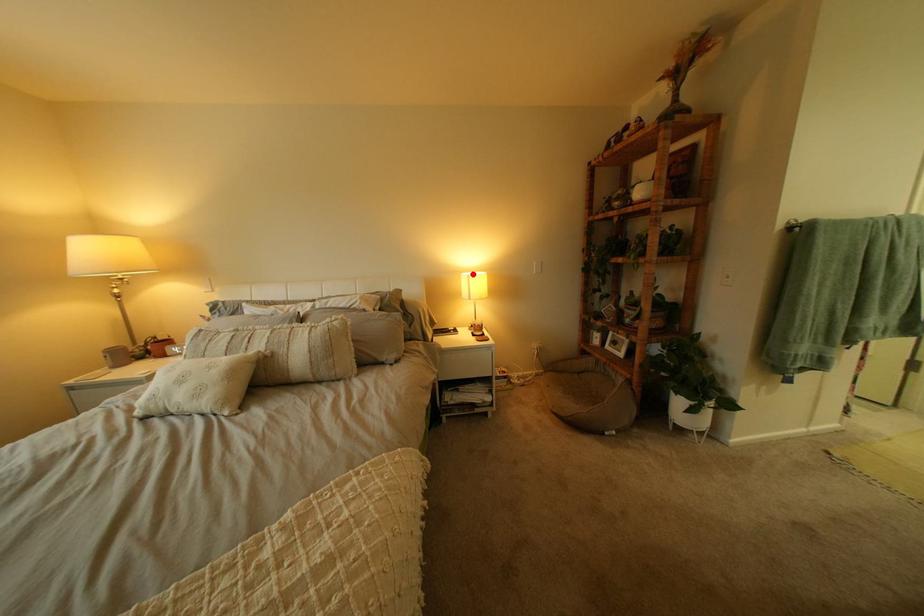
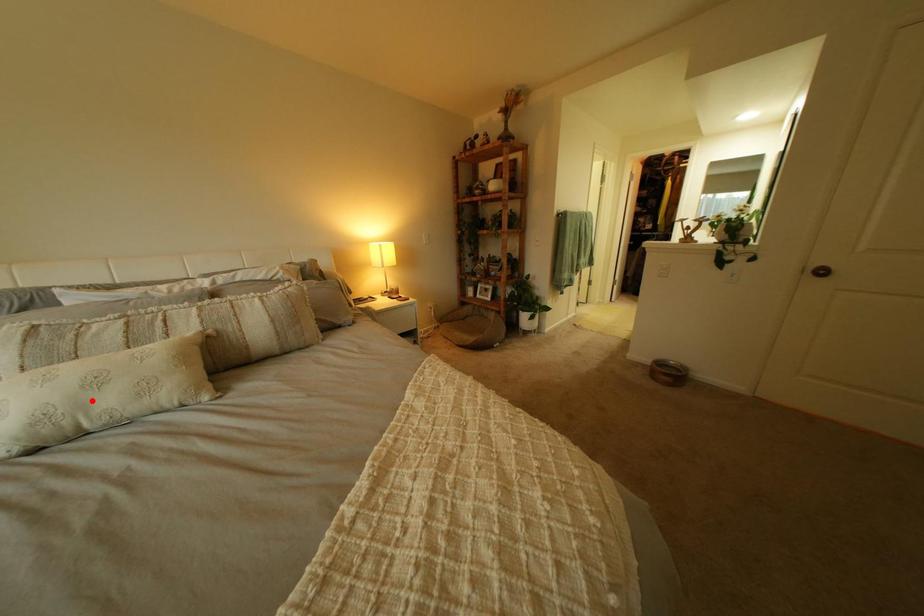
I am providing you with two images of the same scene from different viewpoints. A red point is marked on the first image and another point is marked on the second image. Is the marked point in image1 the same physical position as the marked point in image2?

No